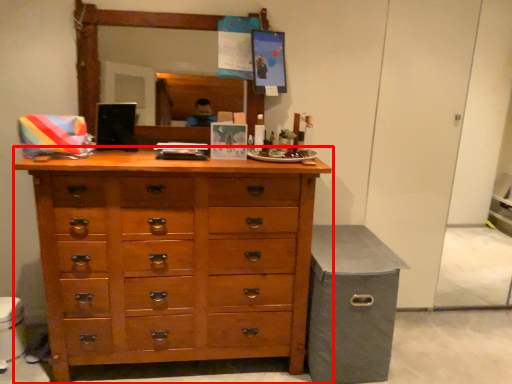
Question: Considering the relative positions of chest of drawers (annotated by the red box) and cabinetry in the image provided, where is chest of drawers (annotated by the red box) located with respect to the staircase?

Choices:
 (A) left
 (B) right

Answer: (A)